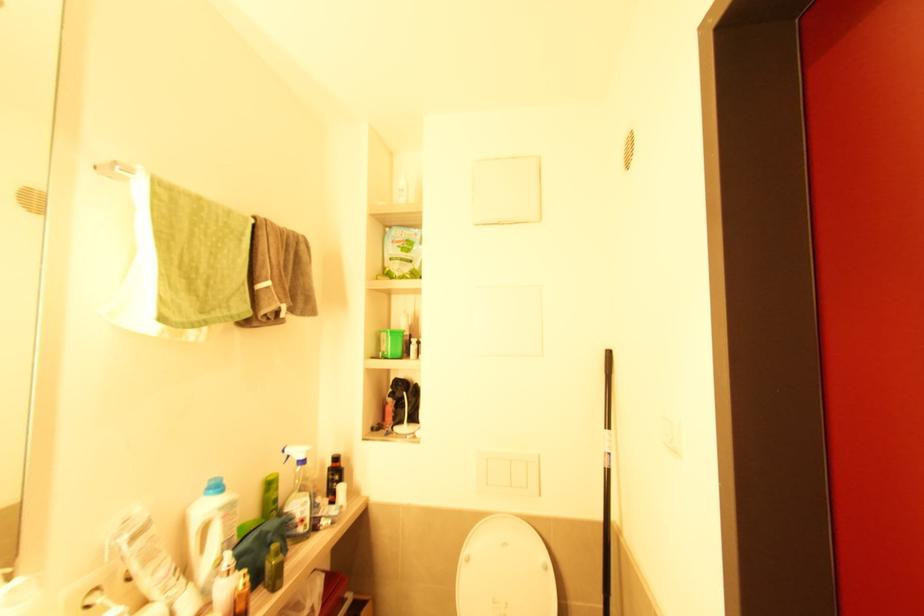
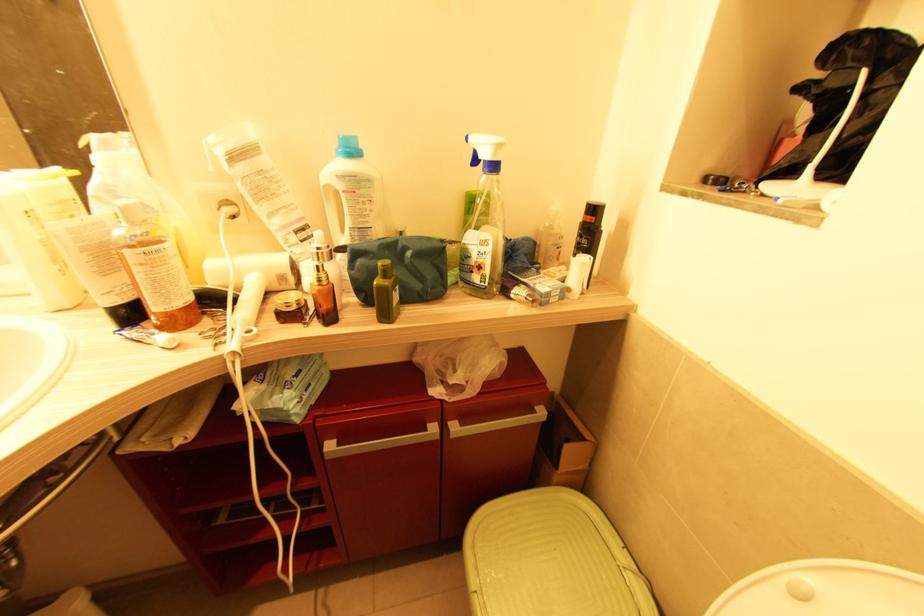
Where in the second image is the point corresponding to point (271, 537) from the first image?

(409, 254)